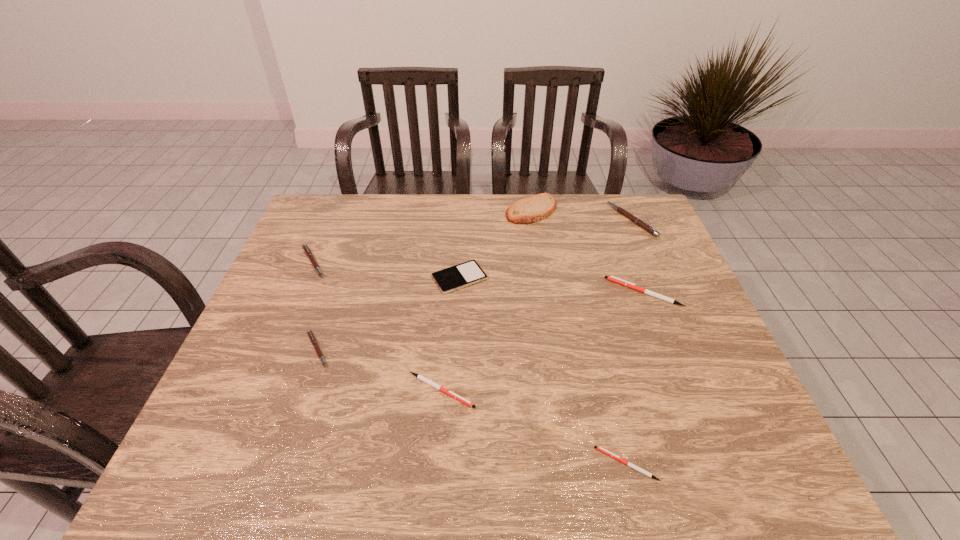
Locate an element on the screen. This screenshot has width=960, height=540. the second closest pink pen to the fourth pen from right to left is located at coordinates (305, 247).

Where is `pink pen that stands as the second closest to the second nearest object`? pink pen that stands as the second closest to the second nearest object is located at coordinates (305, 247).

The width and height of the screenshot is (960, 540). Find the location of `white pen that stands as the third closest to the biggest pink pen`. white pen that stands as the third closest to the biggest pink pen is located at coordinates (601, 449).

Find the location of a particular element. the second closest white pen to the iPod is located at coordinates (614, 279).

The height and width of the screenshot is (540, 960). Find the location of `vacant space that satisfies the following two spatial constraints: 1. on the front side of the tallest object; 2. on the clicker of the second nearest white pen`. vacant space that satisfies the following two spatial constraints: 1. on the front side of the tallest object; 2. on the clicker of the second nearest white pen is located at coordinates (558, 390).

Identify the location of vacant position in the image that satisfies the following two spatial constraints: 1. on the back side of the gray iPod; 2. at the nib of the leftmost object. This screenshot has height=540, width=960. (460, 262).